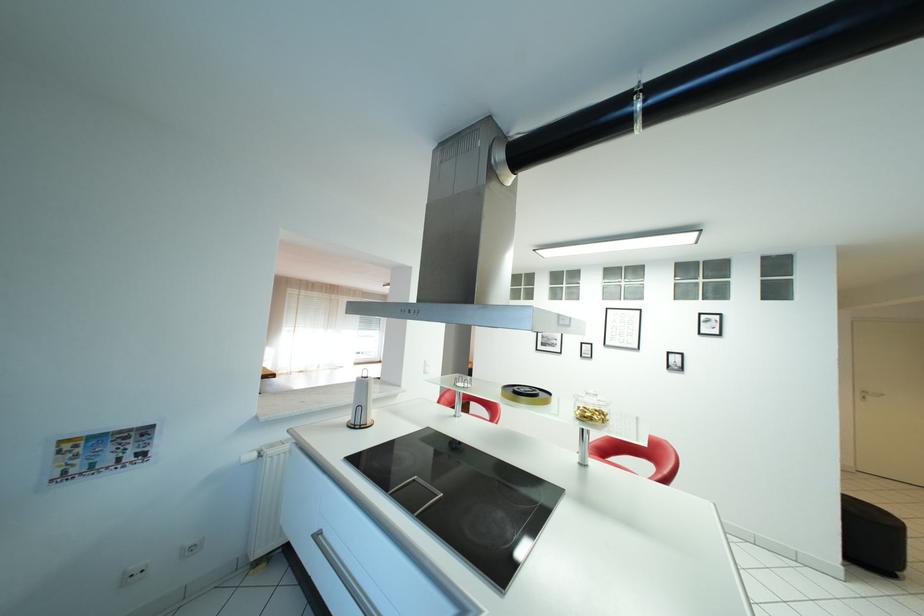
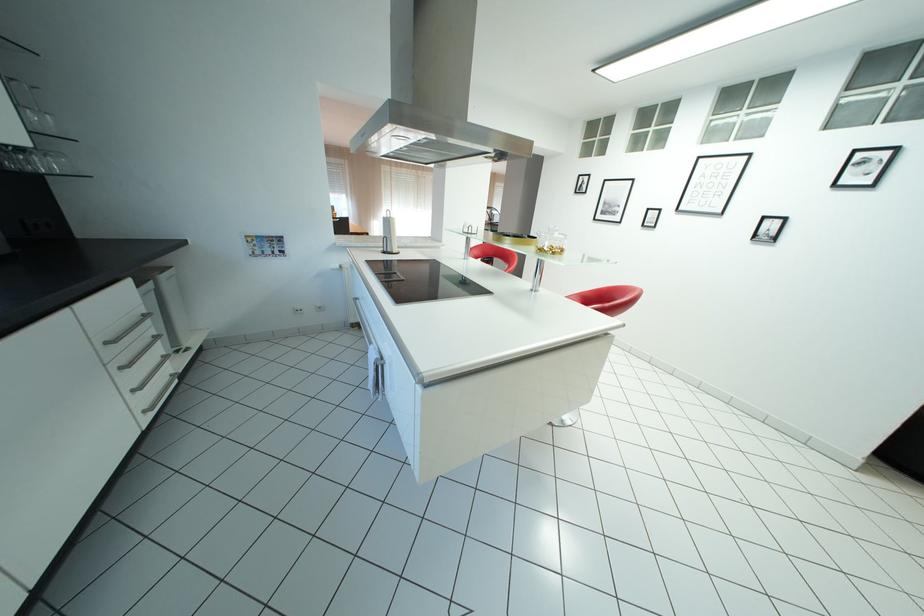
How did the camera likely rotate?

The rotation direction of the camera is left-down.